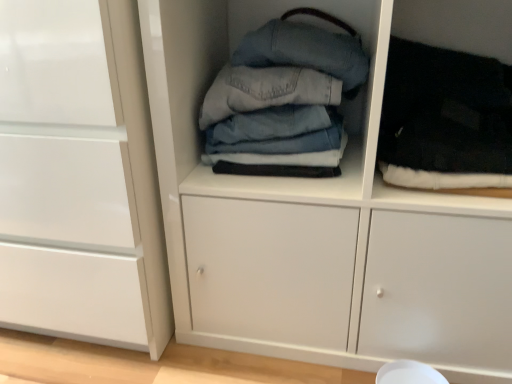
Question: Considering the relative sizes of white glossy cabinet at left and denim fabric stack at center in the image provided, is white glossy cabinet at left smaller than denim fabric stack at center?

Choices:
 (A) no
 (B) yes

Answer: (A)

Question: From the image's perspective, is white glossy cabinet at left located beneath denim fabric stack at center?

Choices:
 (A) yes
 (B) no

Answer: (B)

Question: Are white glossy cabinet at left and denim fabric stack at center far apart?

Choices:
 (A) yes
 (B) no

Answer: (B)

Question: Is white glossy cabinet at left facing towards denim fabric stack at center?

Choices:
 (A) yes
 (B) no

Answer: (B)

Question: From a real-world perspective, is white glossy cabinet at left physically below denim fabric stack at center?

Choices:
 (A) yes
 (B) no

Answer: (B)

Question: Based on their sizes in the image, would you say white glossy cabinet at left is bigger or smaller than denim fabric stack at center?

Choices:
 (A) small
 (B) big

Answer: (B)

Question: Is white glossy cabinet at left inside the boundaries of denim fabric stack at center, or outside?

Choices:
 (A) outside
 (B) inside

Answer: (A)

Question: Considering the positions of white glossy cabinet at left and denim fabric stack at center in the image, is white glossy cabinet at left wider or thinner than denim fabric stack at center?

Choices:
 (A) wide
 (B) thin

Answer: (A)

Question: Relative to denim fabric stack at center, is white glossy cabinet at left in front or behind?

Choices:
 (A) behind
 (B) front

Answer: (A)

Question: In the image, is black fuzzy socks at right, the first clothing in the right-to-left sequence, positioned in front of or behind denim fabric stack at center?

Choices:
 (A) behind
 (B) front

Answer: (A)

Question: Is point [x=451, y=157] closer or farther from the camera than point [x=214, y=249]?

Choices:
 (A) closer
 (B) farther

Answer: (A)

Question: From the image's perspective, is black fuzzy socks at right, the first clothing in the right-to-left sequence, above or below denim fabric stack at center?

Choices:
 (A) below
 (B) above

Answer: (B)

Question: From a real-world perspective, is black fuzzy socks at right, the first clothing in the right-to-left sequence, above or below denim fabric stack at center?

Choices:
 (A) above
 (B) below

Answer: (A)

Question: From a real-world perspective, is denim fabric jeans at center, acting as the second clothing starting from the right, above or below white glossy cabinet at left?

Choices:
 (A) below
 (B) above

Answer: (B)

Question: Based on their positions, is denim fabric jeans at center, acting as the second clothing starting from the right, located to the left or right of white glossy cabinet at left?

Choices:
 (A) left
 (B) right

Answer: (B)